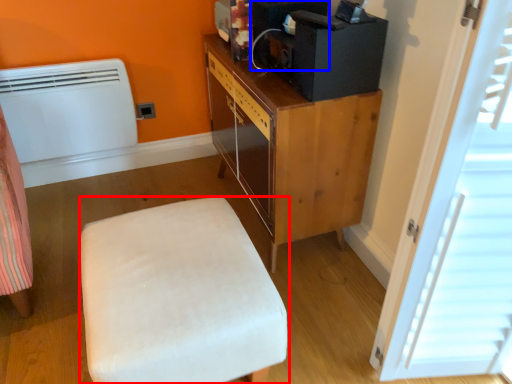
Question: Among these objects, which one is nearest to the camera, furniture (highlighted by a red box) or appliance (highlighted by a blue box)?

Choices:
 (A) furniture
 (B) appliance

Answer: (A)